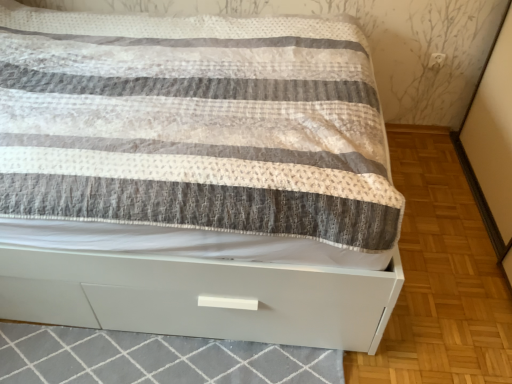
What do you see at coordinates (195, 177) in the screenshot? I see `white glossy bed at center` at bounding box center [195, 177].

This screenshot has width=512, height=384. What are the coordinates of `white glossy bed at center` in the screenshot? It's located at (195, 177).

Measure the distance between point (136, 233) and camera.

Point (136, 233) is 1.26 meters from camera.

What is the approximate height of white glossy bed at center?

33.09 inches.

Describe the element at coordinates (154, 358) in the screenshot. The height and width of the screenshot is (384, 512). I see `white glossy drawer at lower center` at that location.

What are the coordinates of `white glossy drawer at lower center` in the screenshot? It's located at (154, 358).

Locate an element on the screen. The image size is (512, 384). white glossy bed at center is located at coordinates (195, 177).

Considering the relative positions of white glossy drawer at lower center and white glossy bed at center in the image provided, is white glossy drawer at lower center to the left or to the right of white glossy bed at center?

white glossy drawer at lower center is to the right of white glossy bed at center.

Which object is closer to the camera, white glossy drawer at lower center or white glossy bed at center?

Positioned in front is white glossy bed at center.

Which is farther from the camera, [12,378] or [319,80]?

The point [319,80] is farther from the camera.

Looking at this image, from the image's perspective, does white glossy drawer at lower center appear lower than white glossy bed at center?

Yes, from the image's perspective, white glossy drawer at lower center is beneath white glossy bed at center.

From the picture: From a real-world perspective, between white glossy drawer at lower center and white glossy bed at center, who is vertically higher?

white glossy bed at center is physically above.

Which of these two, white glossy drawer at lower center or white glossy bed at center, is thinner?

Thinner between the two is white glossy drawer at lower center.

Which of these two, white glossy drawer at lower center or white glossy bed at center, stands shorter?

With less height is white glossy drawer at lower center.

Who is bigger, white glossy drawer at lower center or white glossy bed at center?

Bigger between the two is white glossy bed at center.

Choose the correct answer: Is white glossy drawer at lower center inside white glossy bed at center or outside it?

white glossy drawer at lower center cannot be found inside white glossy bed at center.

Are white glossy drawer at lower center and white glossy bed at center far apart?

They are positioned close to each other.

Is white glossy bed at center at the back of white glossy drawer at lower center?

No.

How far apart are white glossy drawer at lower center and white glossy bed at center?

A distance of 65.64 centimeters exists between white glossy drawer at lower center and white glossy bed at center.

Locate an element on the screen. tile behind the white glossy bed at center is located at coordinates (154, 358).

Does white glossy bed at center appear on the left side of white glossy drawer at lower center?

Indeed, white glossy bed at center is positioned on the left side of white glossy drawer at lower center.

Which is in front, white glossy bed at center or white glossy drawer at lower center?

white glossy bed at center is closer to the camera.

Which is less distant, (169, 331) or (61, 330)?

Point (169, 331).

From the image's perspective, is white glossy bed at center positioned above or below white glossy drawer at lower center?

white glossy bed at center is above white glossy drawer at lower center.

Based on the photo, from a real-world perspective, between white glossy bed at center and white glossy drawer at lower center, who is vertically lower?

From a 3D spatial view, white glossy drawer at lower center is below.

Which object is wider, white glossy bed at center or white glossy drawer at lower center?

Wider between the two is white glossy bed at center.

Consider the image. Considering the sizes of objects white glossy bed at center and white glossy drawer at lower center in the image provided, who is shorter, white glossy bed at center or white glossy drawer at lower center?

white glossy drawer at lower center.

Does white glossy bed at center have a larger size compared to white glossy drawer at lower center?

Correct, white glossy bed at center is larger in size than white glossy drawer at lower center.

Is white glossy bed at center inside or outside of white glossy drawer at lower center?

white glossy bed at center lies outside white glossy drawer at lower center.

Would you consider white glossy bed at center to be distant from white glossy drawer at lower center?

No, white glossy bed at center is not far away from white glossy drawer at lower center.

Is white glossy bed at center looking in the opposite direction of white glossy drawer at lower center?

white glossy bed at center does not have its back to white glossy drawer at lower center.

How different are the orientations of white glossy bed at center and white glossy drawer at lower center in degrees?

white glossy bed at center and white glossy drawer at lower center are facing 1.51 degrees away from each other.

Measure the distance from white glossy bed at center to white glossy drawer at lower center.

white glossy bed at center is 25.84 inches from white glossy drawer at lower center.

You are a GUI agent. You are given a task and a screenshot of the screen. Output one action in this format:
    pyautogui.click(x=<x>, y=<y>)
    Task: Click on the tile below the white glossy bed at center (from a real-world perspective)
    The width and height of the screenshot is (512, 384).
    Given the screenshot: What is the action you would take?
    pyautogui.click(x=154, y=358)

Image resolution: width=512 pixels, height=384 pixels. I want to click on bed located above the white glossy drawer at lower center (from a real-world perspective), so click(x=195, y=177).

Image resolution: width=512 pixels, height=384 pixels. Identify the location of tile on the right of white glossy bed at center. (154, 358).